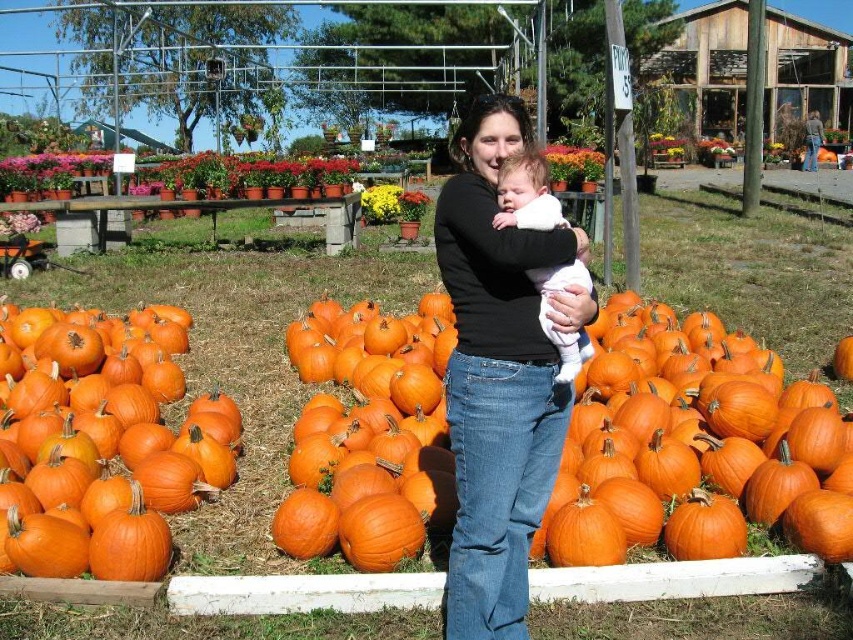
Does orange matte pumpkin at left have a lesser width compared to white soft baby at center?

No, orange matte pumpkin at left is not thinner than white soft baby at center.

Is point (10, 499) more distant than point (570, 346)?

Yes, point (10, 499) is behind point (570, 346).

Between point (149, 428) and point (555, 211), which one is positioned in front?

Point (555, 211) is in front.

Locate an element on the screen. The height and width of the screenshot is (640, 853). orange matte pumpkin at left is located at coordinates (102, 445).

Can you confirm if orange matte pumpkin at left is positioned below black matte shirt at center?

Correct, orange matte pumpkin at left is located below black matte shirt at center.

Who is positioned more to the right, orange matte pumpkin at left or black matte shirt at center?

Positioned to the right is black matte shirt at center.

Which is in front, point (161, 442) or point (563, 321)?

Positioned in front is point (563, 321).

This screenshot has width=853, height=640. I want to click on orange matte pumpkin at left, so click(x=102, y=445).

Measure the distance between point (x=519, y=532) and camera.

Point (x=519, y=532) and camera are 2.57 meters apart from each other.

Can you confirm if black matte shirt at center is positioned above white soft baby at center?

Indeed, black matte shirt at center is positioned over white soft baby at center.

I want to click on black matte shirt at center, so click(496, 378).